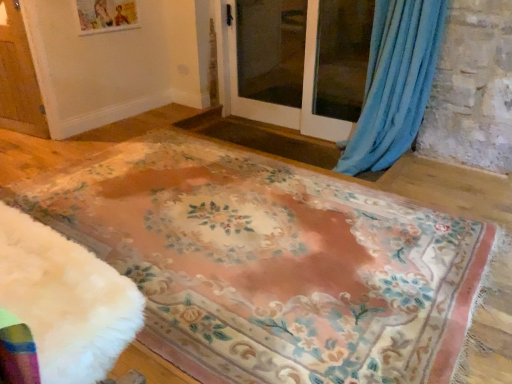
Question: Should I look upward or downward to see wooden screen door at left, arranged as the 3th screen door when viewed from the right?

Choices:
 (A) down
 (B) up

Answer: (B)

Question: Is blue soft fabric curtain at upper right facing away from floral-patterned carpet at center?

Choices:
 (A) yes
 (B) no

Answer: (B)

Question: Can you confirm if blue soft fabric curtain at upper right is thinner than floral-patterned carpet at center?

Choices:
 (A) no
 (B) yes

Answer: (B)

Question: Does blue soft fabric curtain at upper right appear on the left side of floral-patterned carpet at center?

Choices:
 (A) yes
 (B) no

Answer: (B)

Question: From the image's perspective, is blue soft fabric curtain at upper right on top of floral-patterned carpet at center?

Choices:
 (A) yes
 (B) no

Answer: (A)

Question: Is blue soft fabric curtain at upper right to the right of floral-patterned carpet at center from the viewer's perspective?

Choices:
 (A) no
 (B) yes

Answer: (B)

Question: Is blue soft fabric curtain at upper right behind floral-patterned carpet at center?

Choices:
 (A) yes
 (B) no

Answer: (A)

Question: Is clear glass screen door at center, the second screen door when ordered from left to right, further to the viewer compared to wooden screen door at left, placed as the first screen door when sorted from left to right?

Choices:
 (A) no
 (B) yes

Answer: (B)

Question: Is clear glass screen door at center, which is the second screen door in right-to-left order, located outside wooden screen door at left, arranged as the 3th screen door when viewed from the right?

Choices:
 (A) yes
 (B) no

Answer: (A)

Question: Is wooden screen door at left, placed as the first screen door when sorted from left to right, completely or partially inside clear glass screen door at center, which is the second screen door in right-to-left order?

Choices:
 (A) yes
 (B) no

Answer: (B)

Question: From a real-world perspective, is clear glass screen door at center, which is the second screen door in right-to-left order, on wooden screen door at left, arranged as the 3th screen door when viewed from the right?

Choices:
 (A) yes
 (B) no

Answer: (B)

Question: Considering the relative sizes of clear glass screen door at center, the second screen door when ordered from left to right, and wooden screen door at left, placed as the first screen door when sorted from left to right, in the image provided, is clear glass screen door at center, the second screen door when ordered from left to right, smaller than wooden screen door at left, placed as the first screen door when sorted from left to right,?

Choices:
 (A) yes
 (B) no

Answer: (B)

Question: Considering the relative sizes of clear glass screen door at center, which is the second screen door in right-to-left order, and wooden screen door at left, placed as the first screen door when sorted from left to right, in the image provided, is clear glass screen door at center, which is the second screen door in right-to-left order, taller than wooden screen door at left, placed as the first screen door when sorted from left to right,?

Choices:
 (A) yes
 (B) no

Answer: (A)

Question: Does floral-patterned carpet at center have a lesser width compared to wooden screen door at left, placed as the first screen door when sorted from left to right?

Choices:
 (A) yes
 (B) no

Answer: (B)